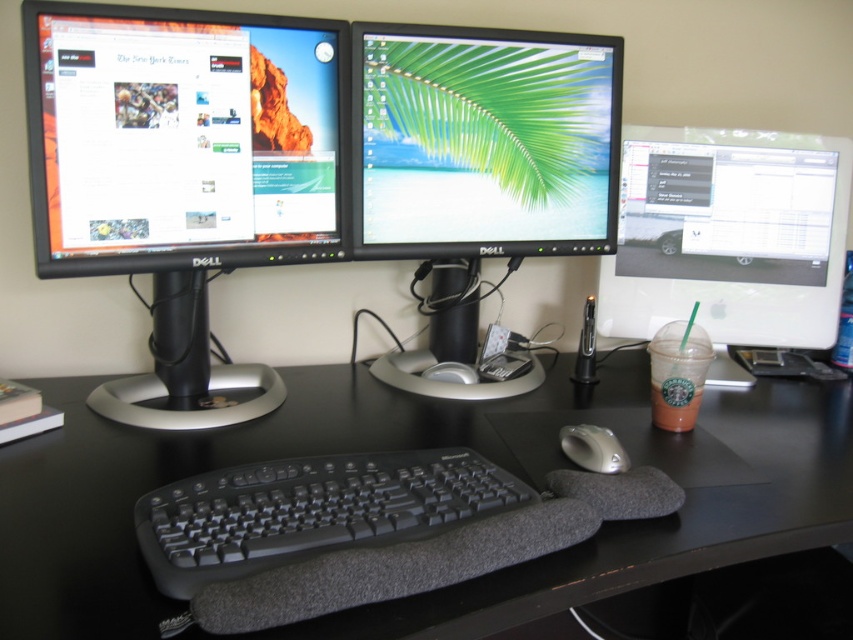
You are setting up a new monitor in the workstation. The new monitor has a width of 22 inches. The existing monitors are arranged in a straight line. The point at coordinates (183, 173) marks the location of the black glossy monitor at left. If the distance between the left edge of the black glossy monitor at left and the right edge of the Dell monitor next to it is 3 inches, will the new monitor fit between them without overlapping?

The distance between the left edge of the black glossy monitor at left and the right edge of the Dell monitor next to it is 3 inches. Since the new monitor is 22 inches wide, it will not fit between them without overlapping because 22 inches is much larger than the 3 inches of available space.

You are a person sitting at the desk and want to reach the black rubberized keyboard at center. What are the coordinates of the keyboard?

The coordinates of the black rubberized keyboard at center are at point (312, 509).

You are a remote worker who needs to reach for your mouse while keeping your hands on the keyboard. Based on the workstation setup, can you easily access the silver metallic mouse at center from the black rubberized keyboard at center?

The black rubberized keyboard at center is in front of the silver metallic mouse at center, meaning the mouse is behind the keyboard. Since the keyboard is blocking direct access, you would need to move your hand around or over the keyboard to reach the mouse, making it somewhat inconvenient.